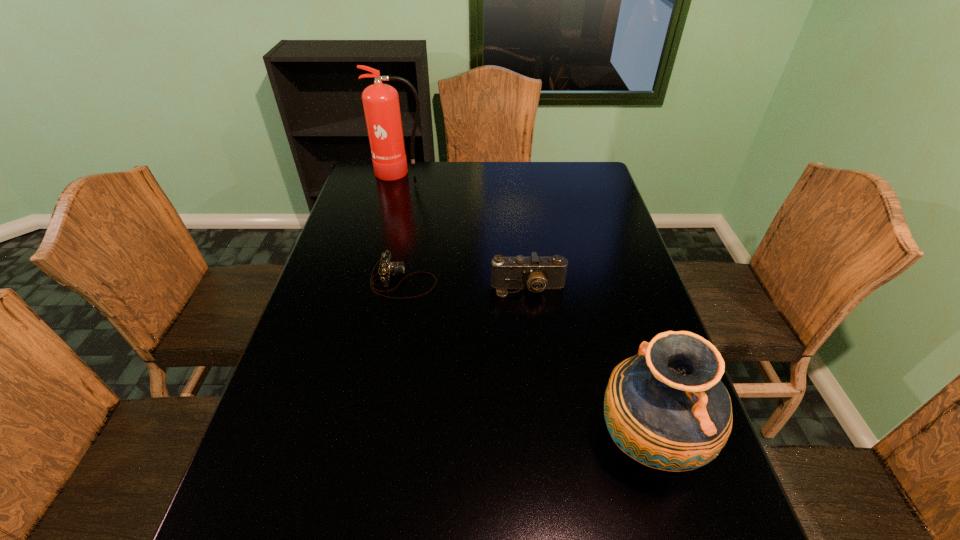
At what (x,y) coordinates should I click in order to perform the action: click on free space located 0.250m on the front-facing side of the right camera. Please return your answer as a coordinate pair (x, y). This screenshot has width=960, height=540. Looking at the image, I should click on (538, 377).

Identify the location of vacant region located on the front-facing side of the shortest object. (462, 281).

The height and width of the screenshot is (540, 960). Find the location of `object present at the far edge`. object present at the far edge is located at coordinates (381, 105).

This screenshot has height=540, width=960. In order to click on fire extinguisher that is at the left edge in this screenshot , I will do `click(381, 105)`.

At what (x,y) coordinates should I click in order to perform the action: click on camera at the left edge. Please return your answer as a coordinate pair (x, y). The image size is (960, 540). Looking at the image, I should click on (387, 268).

Find the location of `object present at the right edge`. object present at the right edge is located at coordinates (666, 407).

Locate an element on the screen. This screenshot has width=960, height=540. object at the far left corner is located at coordinates (381, 105).

In the image, there is a desktop. Identify the location of vacant region at the far edge. (470, 167).

In order to click on vacant space at the left edge of the desktop in this screenshot , I will do `click(284, 474)`.

The width and height of the screenshot is (960, 540). In the image, there is a desktop. Identify the location of vacant space at the right edge. (684, 537).